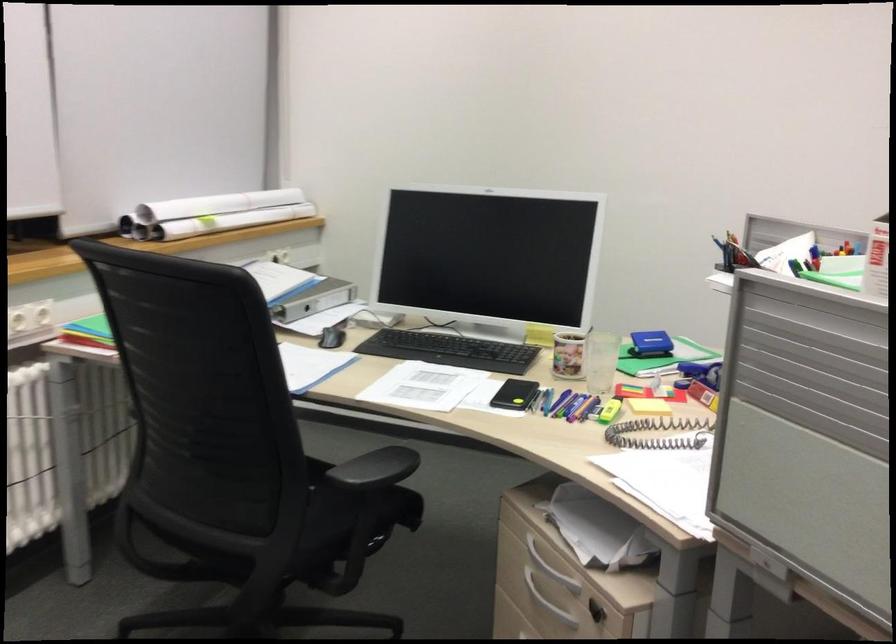
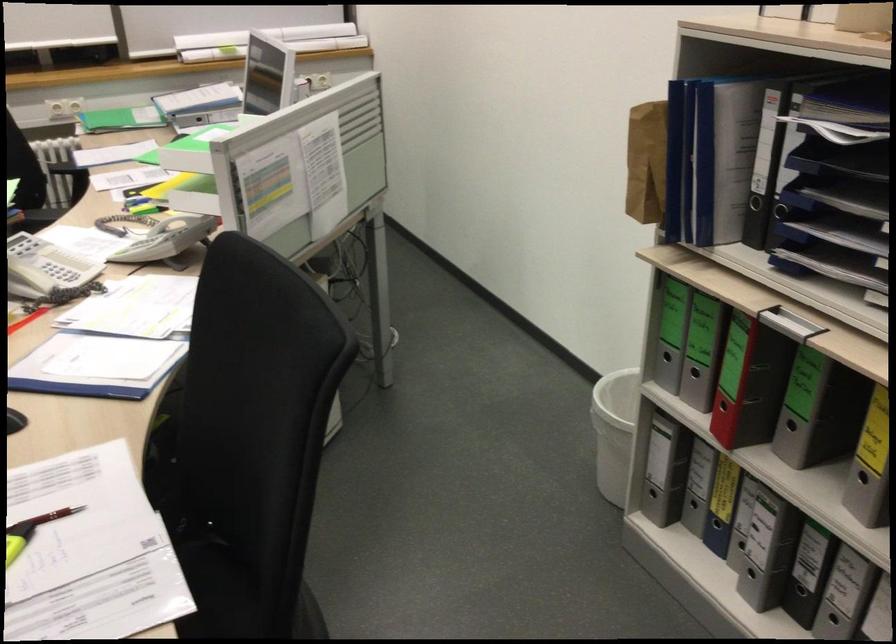
Question: I am providing you with two images of the same scene from different viewpoints. Please identify which objects are invisible in image2.

Choices:
 (A) black plastic buckle
 (B) patterned mug
 (C) red binder finger hole
 (D) grey binder finger hole

Answer: (B)